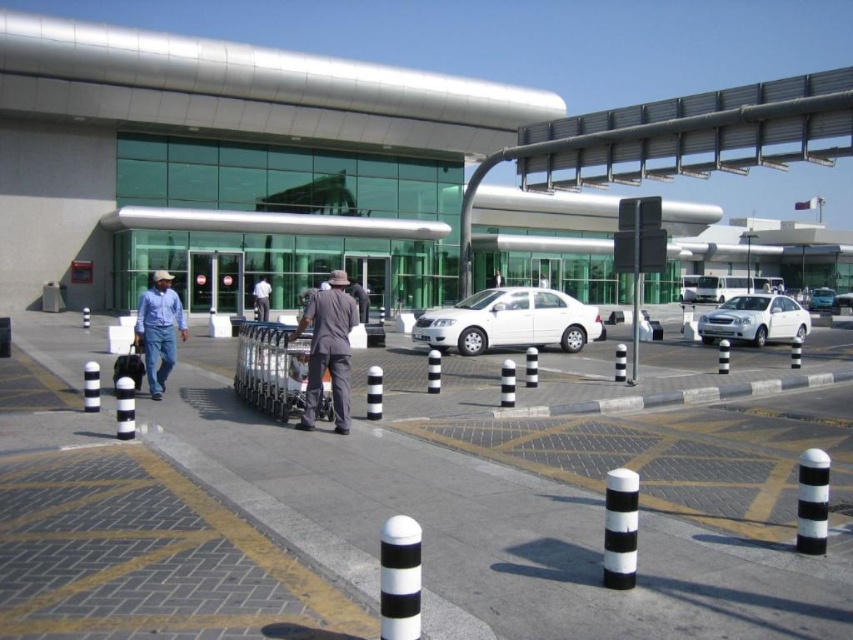
You are standing at the entrance of the airport terminal and need to park your white glossy sedan at right. According to the airport map, the parking lot is located at coordinate point 0.500, 0.885. Can you confirm if your car is already parked in the correct spot?

The white glossy sedan at right is positioned at point (753, 320), which matches the parking lot coordinates. Therefore, the car is correctly parked in the designated area.

You are standing at the entrance of the terminal and want to park your metallic silver sedan at center in the closest available parking spot. According to the airport layout, the parking spots are located at coordinates ranging from 0.4 to 0.5 in the x and y axes. Can you park your car there?

The metallic silver sedan at center is located at point (x=821, y=300). The parking spots are within the range of 0.4 to 0.5 in both axes. Since the sedan is at 0.469 in the x and 0.964 in the y, the x coordinate falls within the parking area, but the y coordinate exceeds the maximum of 0.5. Therefore, the sedan cannot be parked in the designated spots as its current position is outside the y axis range.

You are standing at the airport terminal and want to take a photo of the two points marked in the image. Which point, point (824,305) or point (502,282), is closer to your camera when taking the photo?

Point (502,282) is closer to the camera because it is less further than point (824,305).